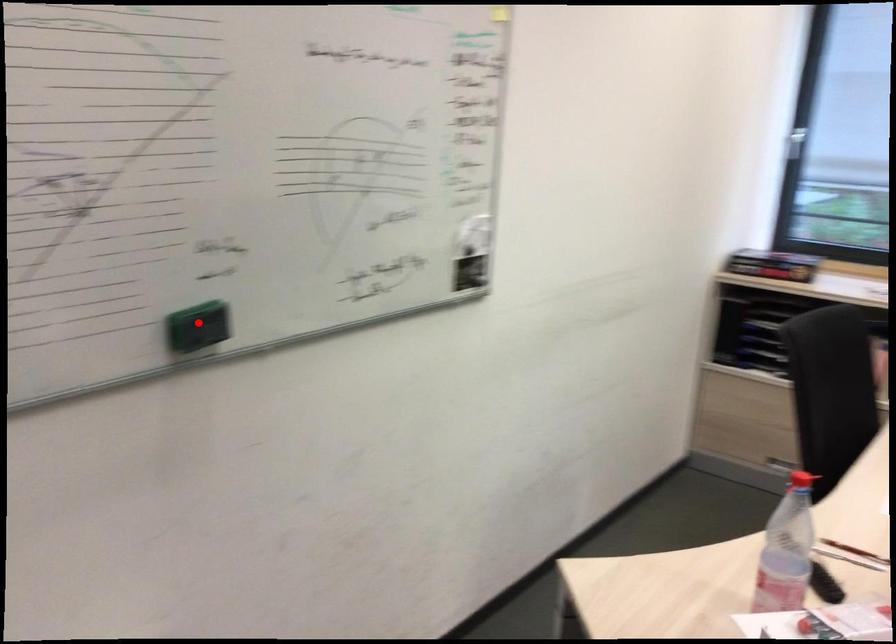
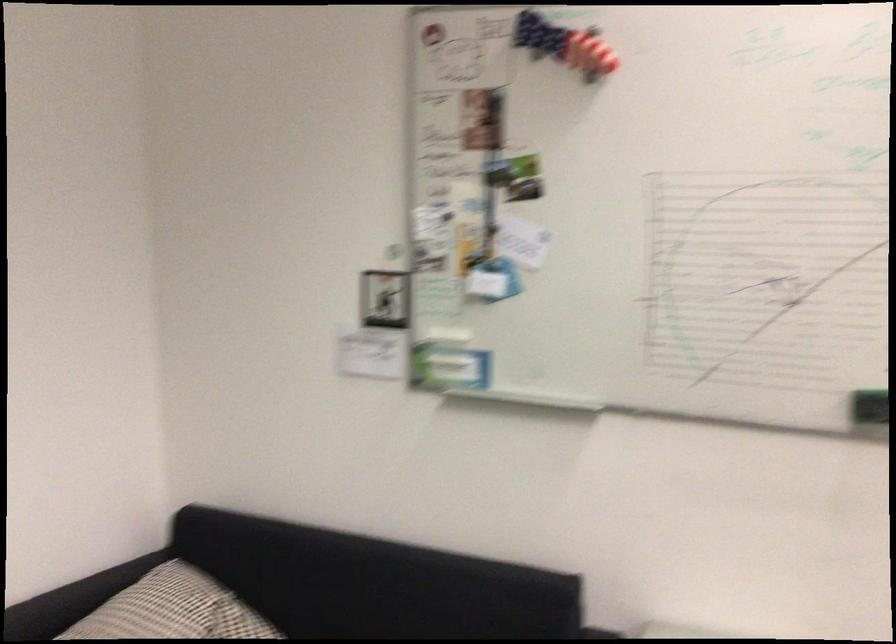
Locate, in the second image, the point that corresponds to the highlighted location in the first image.

(869, 406)